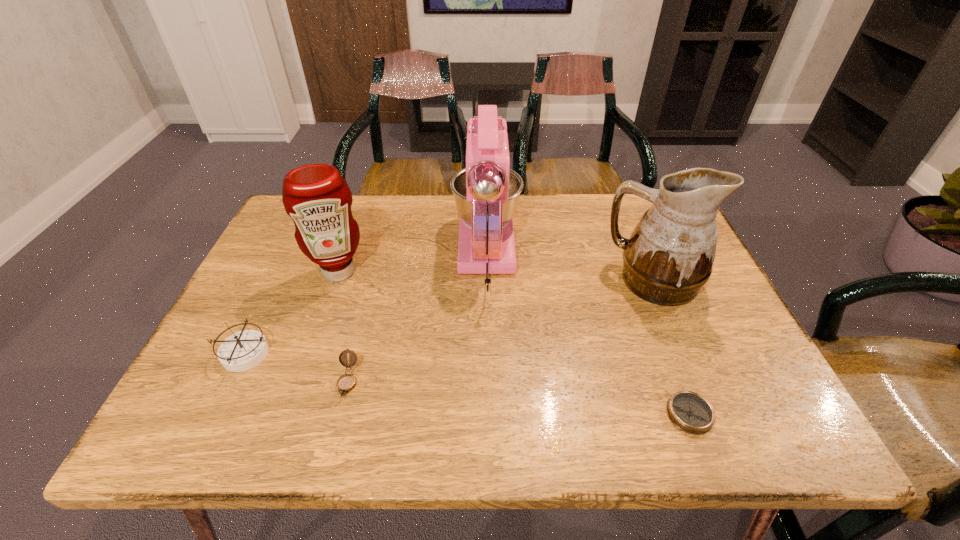
Where is `free location located from the spout of the pitcher`? This screenshot has height=540, width=960. free location located from the spout of the pitcher is located at coordinates [x=579, y=280].

Identify the location of vacant space located from the spout of the pitcher. Image resolution: width=960 pixels, height=540 pixels. (511, 280).

What are the coordinates of `free point located from the spout of the pitcher` in the screenshot? It's located at (583, 280).

I want to click on vacant region located 0.210m on the front of the second object from left to right, so click(x=310, y=355).

I want to click on blank space located on the back of the leftmost object, so click(295, 248).

At what (x,y) coordinates should I click in order to perform the action: click on free spot located on the face of the second compass from left to right. Please return your answer as a coordinate pair (x, y). This screenshot has height=540, width=960. Looking at the image, I should click on (x=333, y=440).

Where is `vacant space positioned on the back of the shortest compass`? vacant space positioned on the back of the shortest compass is located at coordinates (633, 264).

I want to click on object situated at the far edge, so click(486, 192).

The width and height of the screenshot is (960, 540). In order to click on object situated at the near edge in this screenshot , I will do `click(690, 412)`.

Locate an element on the screen. The height and width of the screenshot is (540, 960). condiment that is at the left edge is located at coordinates (317, 198).